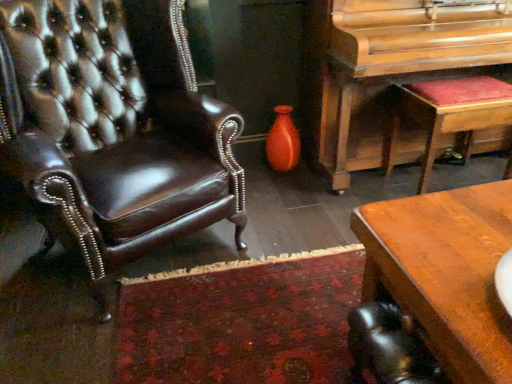
Question: Is matte orange vase at center not inside velvet red stool at right?

Choices:
 (A) yes
 (B) no

Answer: (A)

Question: Can you confirm if matte orange vase at center is thinner than velvet red stool at right?

Choices:
 (A) no
 (B) yes

Answer: (B)

Question: From a real-world perspective, is matte orange vase at center over velvet red stool at right?

Choices:
 (A) no
 (B) yes

Answer: (A)

Question: Is matte orange vase at center bigger than velvet red stool at right?

Choices:
 (A) yes
 (B) no

Answer: (B)

Question: Is matte orange vase at center to the left of velvet red stool at right from the viewer's perspective?

Choices:
 (A) yes
 (B) no

Answer: (A)

Question: In terms of size, does wooden polished piano at right appear bigger or smaller than brown wooden desk at lower right?

Choices:
 (A) small
 (B) big

Answer: (B)

Question: Considering their positions, is wooden polished piano at right located in front of or behind brown wooden desk at lower right?

Choices:
 (A) front
 (B) behind

Answer: (B)

Question: From their relative heights in the image, would you say wooden polished piano at right is taller or shorter than brown wooden desk at lower right?

Choices:
 (A) short
 (B) tall

Answer: (B)

Question: Is point (377, 114) closer or farther from the camera than point (479, 198)?

Choices:
 (A) farther
 (B) closer

Answer: (A)

Question: From the image's perspective, is matte orange vase at center above or below brown wooden desk at lower right?

Choices:
 (A) below
 (B) above

Answer: (B)

Question: Is matte orange vase at center to the left or to the right of brown wooden desk at lower right in the image?

Choices:
 (A) right
 (B) left

Answer: (B)

Question: From a real-world perspective, is matte orange vase at center physically located above or below brown wooden desk at lower right?

Choices:
 (A) above
 (B) below

Answer: (A)

Question: Do you think matte orange vase at center is within brown wooden desk at lower right, or outside of it?

Choices:
 (A) inside
 (B) outside

Answer: (B)

Question: From their relative heights in the image, would you say velvet red stool at right is taller or shorter than matte orange vase at center?

Choices:
 (A) tall
 (B) short

Answer: (A)

Question: From a real-world perspective, is velvet red stool at right physically located above or below matte orange vase at center?

Choices:
 (A) below
 (B) above

Answer: (B)